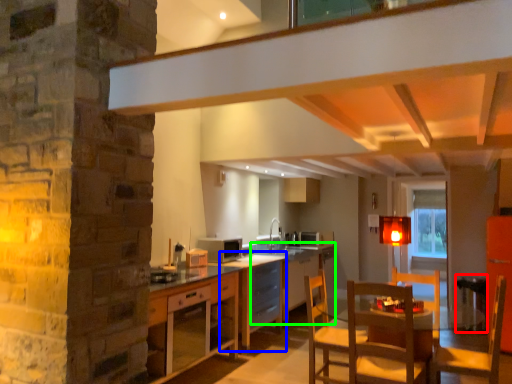
Question: Estimate the real-world distances between objects in this image. Which object is closer to bar stool (highlighted by a red box), table (highlighted by a blue box) or table (highlighted by a green box)?

Choices:
 (A) table
 (B) table

Answer: (A)